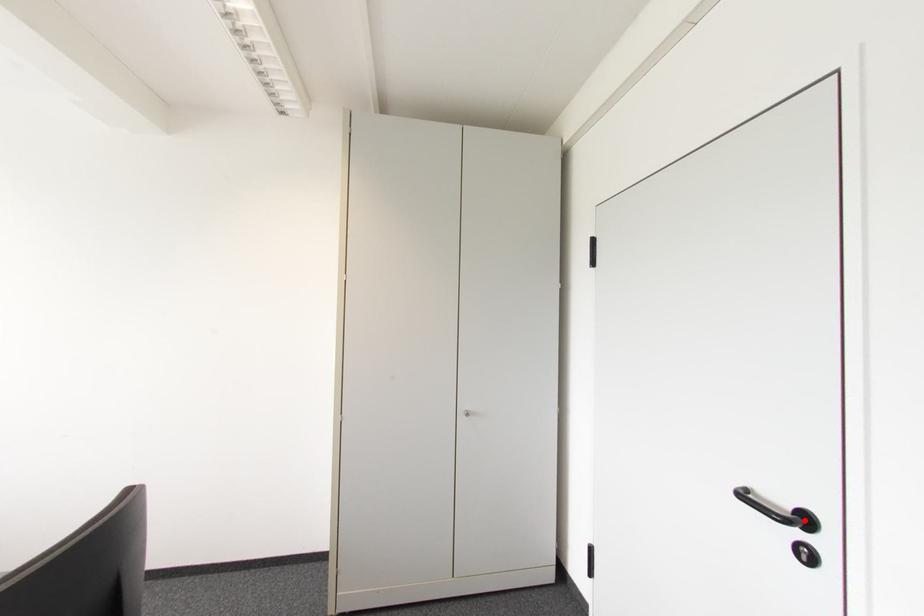
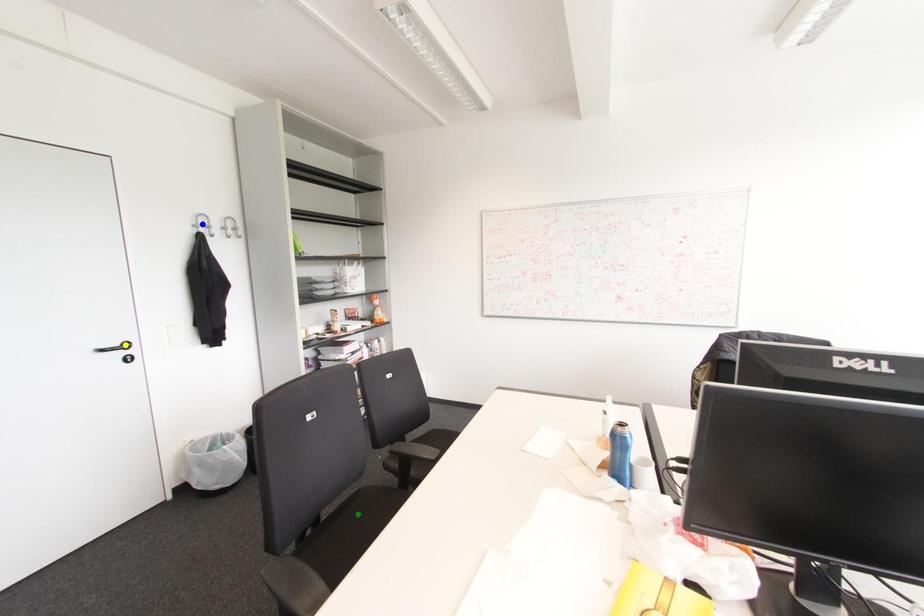
Question: I am providing you with two images of the same scene from different viewpoints. A red point is marked on the first image. You are given multiple points on the second image. Can you choose the point in image 2 that corresponds to the point in image 1?

Choices:
 (A) green point
 (B) blue point
 (C) yellow point

Answer: (C)